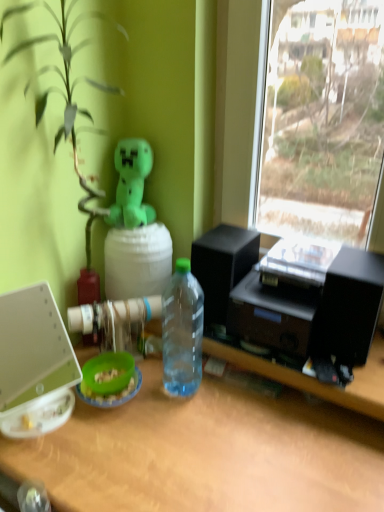
The image size is (384, 512). I want to click on green plush toy at upper center, so click(x=131, y=184).

Image resolution: width=384 pixels, height=512 pixels. What do you see at coordinates (34, 364) in the screenshot?
I see `white plastic laptop at left` at bounding box center [34, 364].

Identify the location of transparent plastic bottle at center. (182, 331).

Considering the sizes of objects white plastic laptop at left and green plush toy at upper center in the image provided, who is wider, white plastic laptop at left or green plush toy at upper center?

Wider between the two is white plastic laptop at left.

Does point (24, 358) come behind point (141, 170)?

That is False.

Does white plastic laptop at left appear on the left side of green plush toy at upper center?

Indeed, white plastic laptop at left is positioned on the left side of green plush toy at upper center.

Which object is thinner, green plush toy at upper center or transparent plastic bottle at center?

transparent plastic bottle at center is thinner.

Does green plush toy at upper center lie behind transparent plastic bottle at center?

Yes, green plush toy at upper center is behind transparent plastic bottle at center.

Is point (132, 182) in front of point (194, 298)?

No, (132, 182) is behind (194, 298).

What are the coordinates of `laptop on the left of transparent plastic bottle at center` in the screenshot? It's located at (34, 364).

Do you think white plastic laptop at left is within transparent plastic bottle at center, or outside of it?

The correct answer is: outside.

Is the position of white plastic laptop at left less distant than that of transparent plastic bottle at center?

Yes, white plastic laptop at left is closer to the viewer.

Consider the image. Which is in front, transparent plastic bottle at center or green plush toy at upper center?

transparent plastic bottle at center.

Is transparent plastic bottle at center positioned beyond the bounds of green plush toy at upper center?

Yes, transparent plastic bottle at center is not within green plush toy at upper center.

Which point is more forward, (184, 284) or (130, 203)?

The point (130, 203) is more forward.

In the scene shown: Can you tell me how much transparent plastic bottle at center and green plush toy at upper center differ in facing direction?

The angular difference between transparent plastic bottle at center and green plush toy at upper center is 1.17 degrees.

Is point (119, 144) positioned in front of point (36, 407)?

No, (119, 144) is further to viewer.

Is green plush toy at upper center positioned far away from white plastic laptop at left?

Actually, green plush toy at upper center and white plastic laptop at left are a little close together.

Who is bigger, green plush toy at upper center or white plastic laptop at left?

Bigger between the two is white plastic laptop at left.

Is white plastic laptop at left at the back of green plush toy at upper center?

No, white plastic laptop at left is not at the back of green plush toy at upper center.

From the image's perspective, which object appears higher, transparent plastic bottle at center or white plastic laptop at left?

transparent plastic bottle at center, from the image's perspective.

Looking at the image, does transparent plastic bottle at center seem bigger or smaller compared to white plastic laptop at left?

In the image, transparent plastic bottle at center appears to be smaller than white plastic laptop at left.

Is transparent plastic bottle at center facing away from white plastic laptop at left?

transparent plastic bottle at center is not turned away from white plastic laptop at left.

Is white plastic laptop at left located within transparent plastic bottle at center?

No, transparent plastic bottle at center does not contain white plastic laptop at left.

This screenshot has height=512, width=384. Identify the location of laptop below the green plush toy at upper center (from the image's perspective). (34, 364).

The height and width of the screenshot is (512, 384). Find the location of `bottle in front of the green plush toy at upper center`. bottle in front of the green plush toy at upper center is located at coordinates (182, 331).

From the image, which object appears to be nearer to transparent plastic bottle at center, white plastic laptop at left or green plush toy at upper center?

The object closer to transparent plastic bottle at center is green plush toy at upper center.

Estimate the real-world distances between objects in this image. Which object is closer to transparent plastic bottle at center, green plush toy at upper center or white plastic laptop at left?

Among the two, green plush toy at upper center is located nearer to transparent plastic bottle at center.

Looking at the image, which one is located closer to green plush toy at upper center, transparent plastic bottle at center or white plastic laptop at left?

transparent plastic bottle at center is positioned closer to the anchor green plush toy at upper center.

From the image, which object appears to be nearer to green plush toy at upper center, white plastic laptop at left or transparent plastic bottle at center?

transparent plastic bottle at center is closer to green plush toy at upper center.

Considering their positions, is transparent plastic bottle at center positioned further to white plastic laptop at left than green plush toy at upper center?

Among the two, green plush toy at upper center is located further to white plastic laptop at left.

Estimate the real-world distances between objects in this image. Which object is closer to white plastic laptop at left, green plush toy at upper center or transparent plastic bottle at center?

transparent plastic bottle at center is positioned closer to the anchor white plastic laptop at left.

Locate an element on the screen. bottle between green plush toy at upper center and white plastic laptop at left from top to bottom is located at coordinates (182, 331).